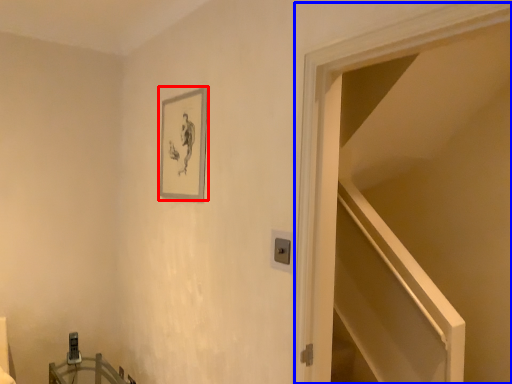
Question: Which point is further to the camera, picture frame (highlighted by a red box) or door (highlighted by a blue box)?

Choices:
 (A) picture frame
 (B) door

Answer: (A)